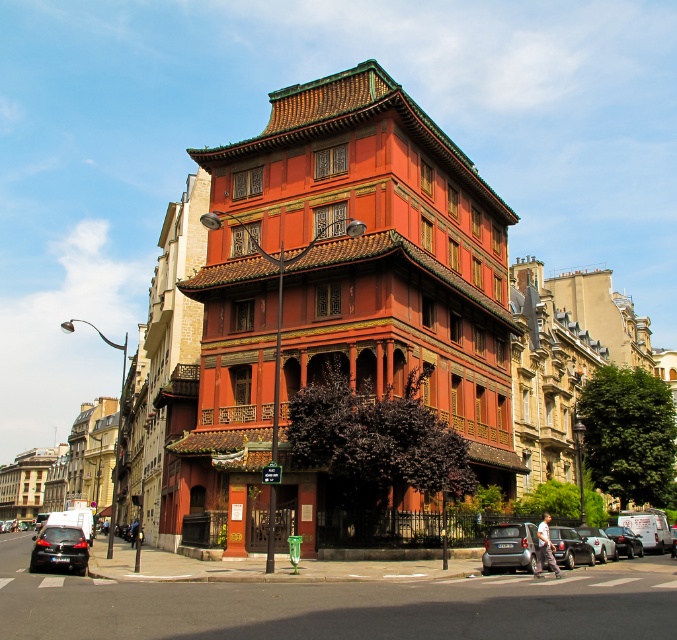
You are a delivery person who needs to park your vehicle in the parking spot near the shiny black sedan at lower left and the shiny black sedan at center. The parking spot can only accommodate vehicles that are shorter than 1.8 meters in height. Which of the two shiny black sedans should you park next to to ensure your vehicle fits?

The shiny black sedan at center is shorter than the shiny black sedan at lower left, so you should park next to the shiny black sedan at center to ensure your vehicle fits within the height restriction.

You are a pedestrian standing at the corner of the street where the vibrant red building is located. You need to cross the street to reach the shiny black sedan at center. Which direction should you walk to avoid the matte silver car at lower right?

You should walk to the right to avoid the matte silver car at lower right because it is positioned to the left of the shiny black sedan at center, so moving right would keep you away from it while heading towards your destination.

You are standing on the street and want to take a photo of the shiny black sedan at lower left without the matte red wood tower at center blocking the view. Is this possible?

The matte red wood tower at center is further to the viewer than the shiny black sedan at lower left, so the tower is closer to you. Therefore, it will block the view of the sedan. You need to move to a position where the tower is not between you and the sedan.